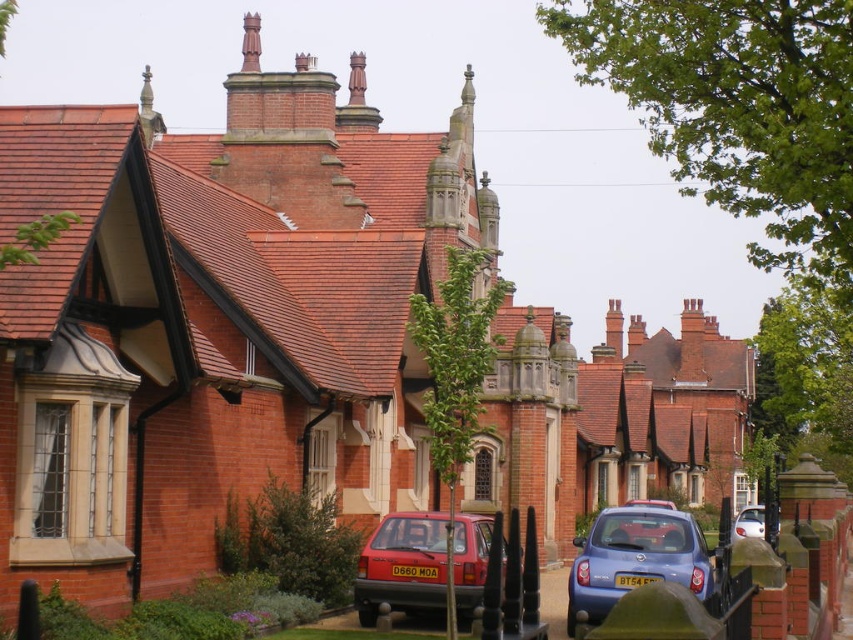
You are a delivery person trying to park your white glossy car at lower right in the driveway next to the matte red hatchback at center. The driveway is only 2 meters wide. Can your car fit next to the hatchback without overlapping?

The matte red hatchback at center is thinner than the white glossy car at lower right. Since the driveway is only 2 meters wide, and the white glossy car at lower right is wider than the matte red hatchback at center, there might not be enough space for both cars to park side by side without overlapping. The combined width of both cars could exceed the driveway width.

You are a delivery driver needing to park your car between the matte red hatchback at center and the nearest house. Is there enough space for your car which is 4.5 meters long?

The distance between the matte red hatchback at center and the nearest house is 61.42 meters, so yes, there is enough space to park your car between them since 61.42 meters is greater than 4.5 meters.